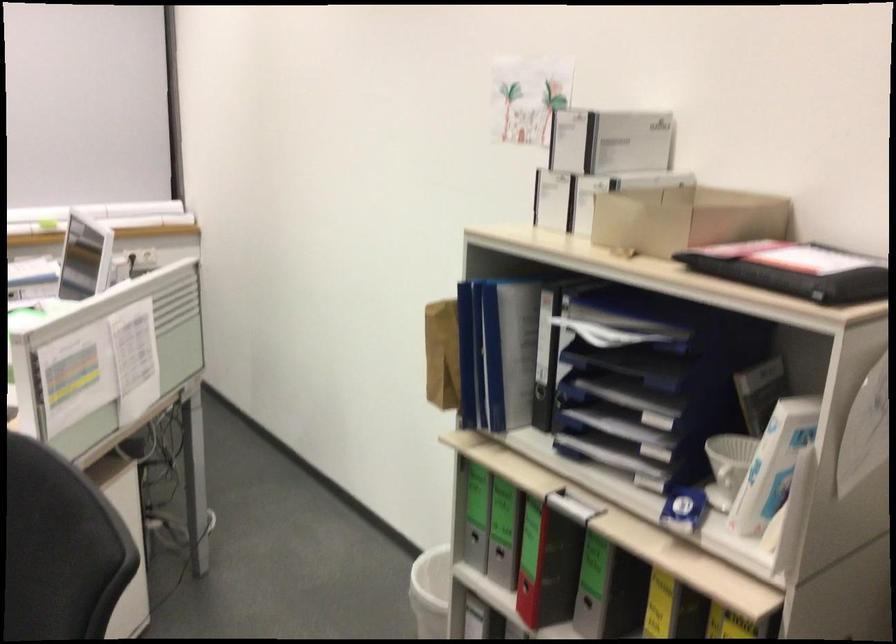
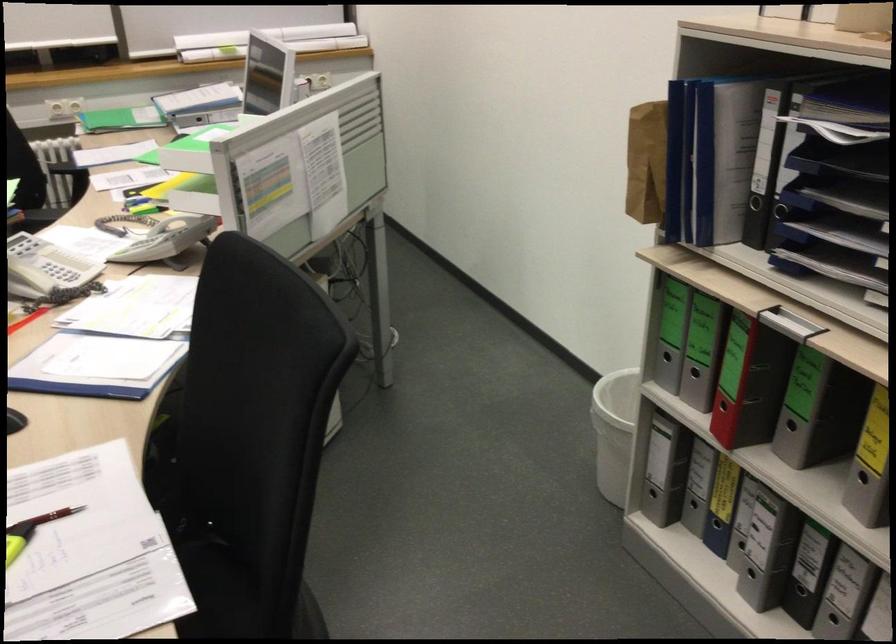
Locate, in the second image, the point that corresponds to (x=610, y=446) in the first image.

(833, 261)